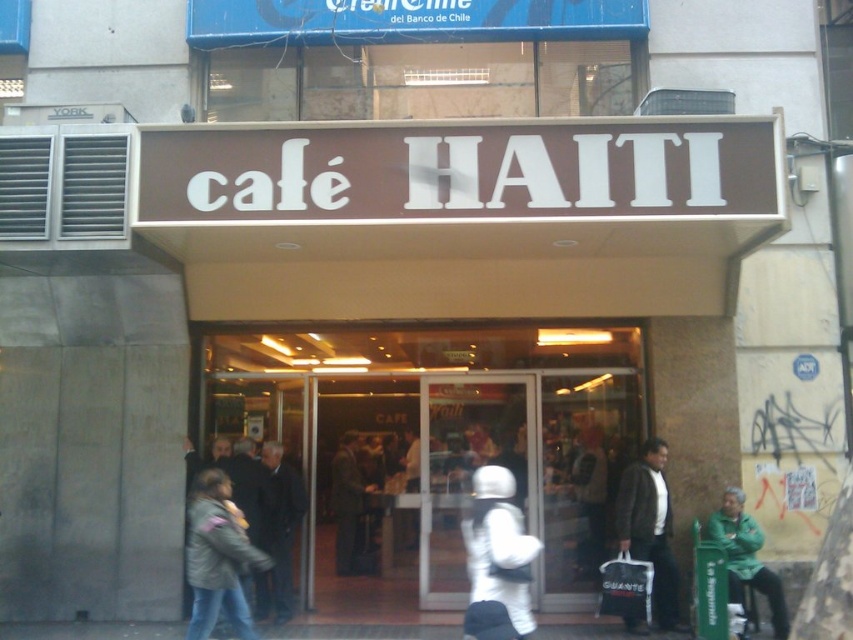
In the scene shown: Does transparent glass door at center come behind gray fuzzy jacket at lower left?

Yes, transparent glass door at center is behind gray fuzzy jacket at lower left.

Is transparent glass door at center to the right of gray fuzzy jacket at lower left from the viewer's perspective?

Indeed, transparent glass door at center is positioned on the right side of gray fuzzy jacket at lower left.

What do you see at coordinates (463, 468) in the screenshot? I see `transparent glass door at center` at bounding box center [463, 468].

Locate an element on the screen. This screenshot has width=853, height=640. transparent glass door at center is located at coordinates (463, 468).

Locate an element on the screen. Image resolution: width=853 pixels, height=640 pixels. white matte astronaut suit at center is located at coordinates (497, 560).

Between white matte astronaut suit at center and dark brown leather jacket at lower right, which one appears on the left side from the viewer's perspective?

white matte astronaut suit at center is more to the left.

I want to click on white matte astronaut suit at center, so (x=497, y=560).

Who is more forward, (x=428, y=568) or (x=775, y=608)?

Point (x=775, y=608) is in front.

Does transparent glass door at center appear under green fabric jacket at lower right?

Incorrect, transparent glass door at center is not positioned below green fabric jacket at lower right.

Who is more forward, (461, 566) or (730, 497)?

Point (730, 497) is more forward.

The image size is (853, 640). Find the location of `transparent glass door at center`. transparent glass door at center is located at coordinates (463, 468).